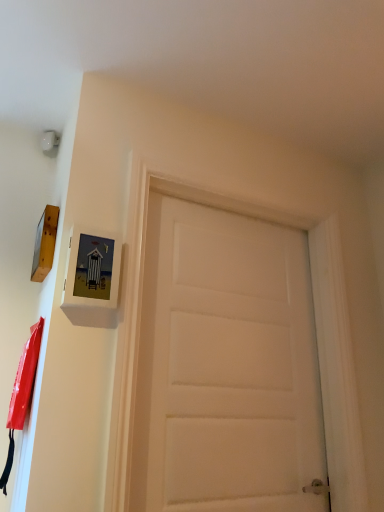
Describe the element at coordinates (225, 366) in the screenshot. I see `white matte door at center` at that location.

Where is `white matte door at center`? white matte door at center is located at coordinates tap(225, 366).

Find the location of `white matte door at center`. white matte door at center is located at coordinates (225, 366).